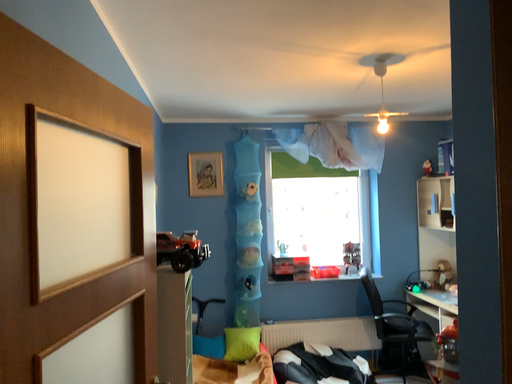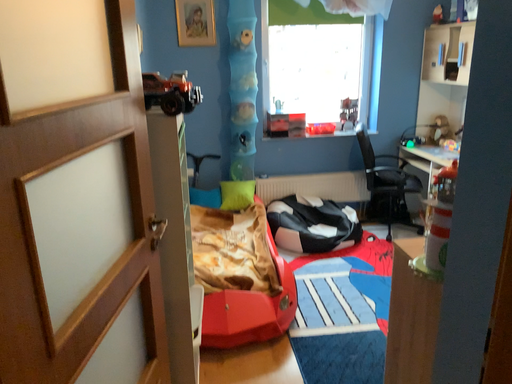
Question: How did the camera likely rotate when shooting the video?

Choices:
 (A) rotated downward
 (B) rotated upward

Answer: (A)